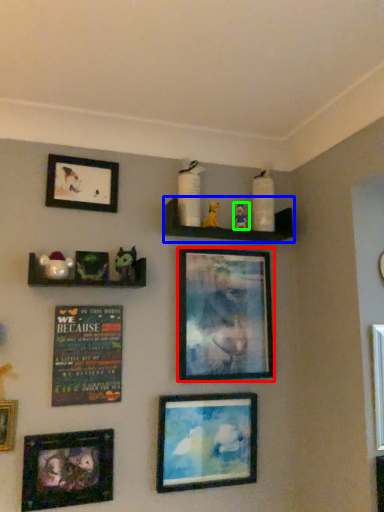
Question: Estimate the real-world distances between objects in this image. Which object is farther from picture frame (highlighted by a red box), shelf (highlighted by a blue box) or toy (highlighted by a green box)?

Choices:
 (A) shelf
 (B) toy

Answer: (B)